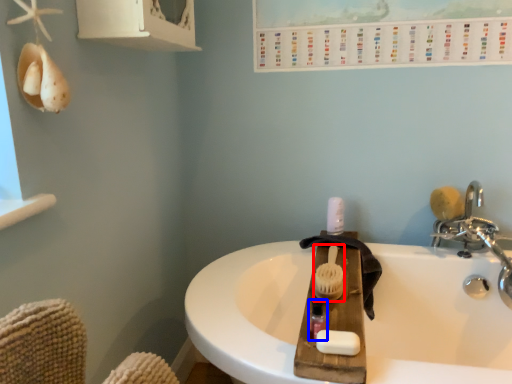
Question: Which point is closer to the camera, brush (highlighted by a red box) or mouthwash (highlighted by a blue box)?

Choices:
 (A) brush
 (B) mouthwash

Answer: (B)